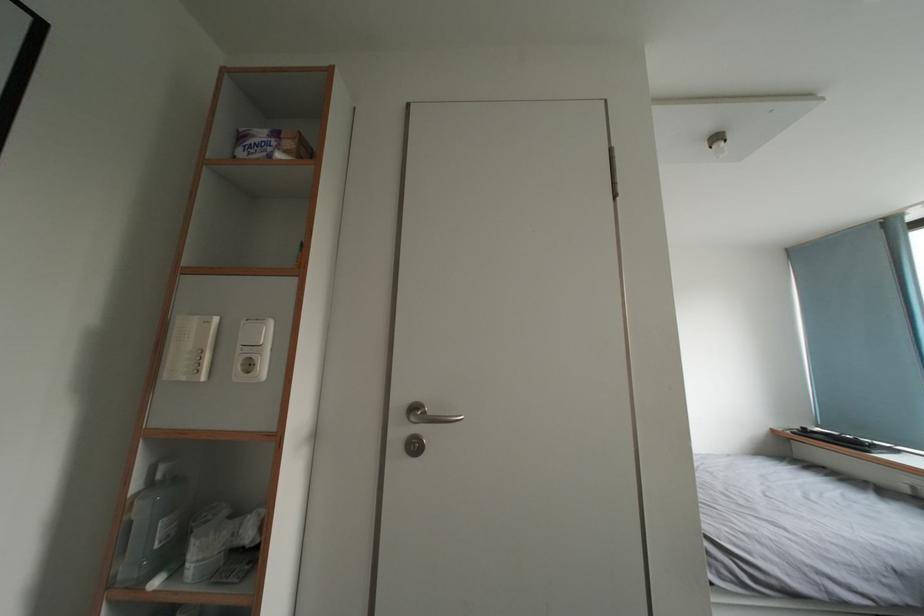
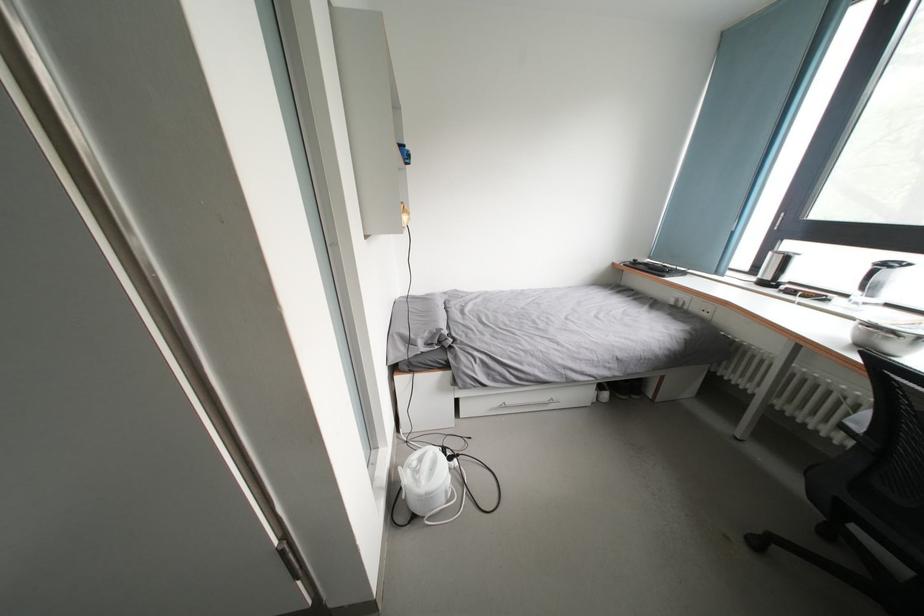
Question: Based on the continuous images, in which direction is the camera rotating? Reply with the corresponding letter.

Choices:
 (A) Left
 (B) Right
 (C) Up
 (D) Down

Answer: (D)